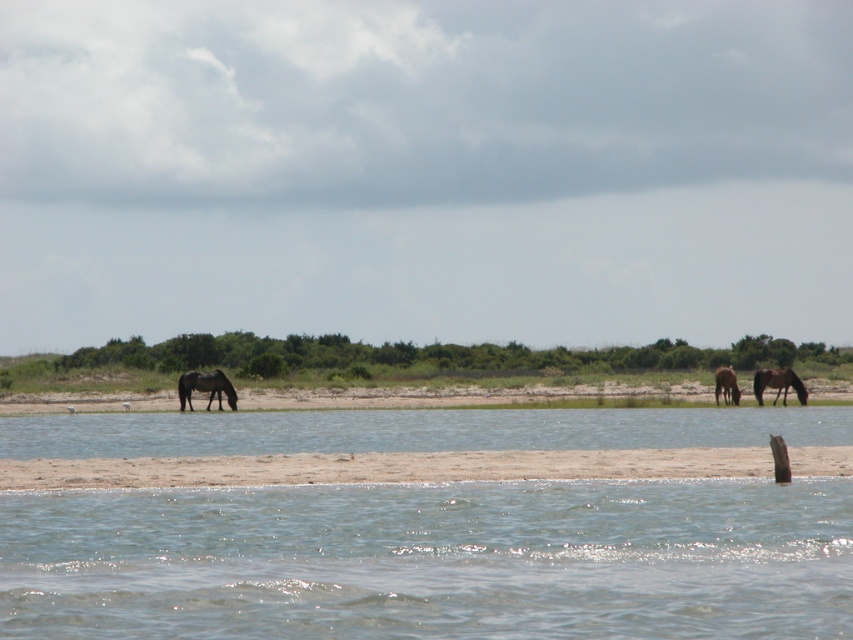
Can you confirm if brown matte horse at right is wider than brown glossy horse at right?

Correct, the width of brown matte horse at right exceeds that of brown glossy horse at right.

Who is more distant from viewer, (786, 387) or (722, 388)?

Point (722, 388)

What are the coordinates of `brown matte horse at right` in the screenshot? It's located at (778, 385).

Is point (502, 522) less distant than point (196, 384)?

Yes, point (502, 522) is in front of point (196, 384).

Does clear water at lower center have a lesser height compared to dark brown glossy horse at center?

Indeed, clear water at lower center has a lesser height compared to dark brown glossy horse at center.

Does point (259, 620) lie behind point (235, 410)?

That is False.

Locate an element on the screen. clear water at lower center is located at coordinates (432, 561).

Between clear water at lower center and brown glossy horse at right, which one has less height?

clear water at lower center

Who is more forward, (198, 534) or (734, 372)?

Point (198, 534) is more forward.

The width and height of the screenshot is (853, 640). Find the location of `clear water at lower center`. clear water at lower center is located at coordinates (432, 561).